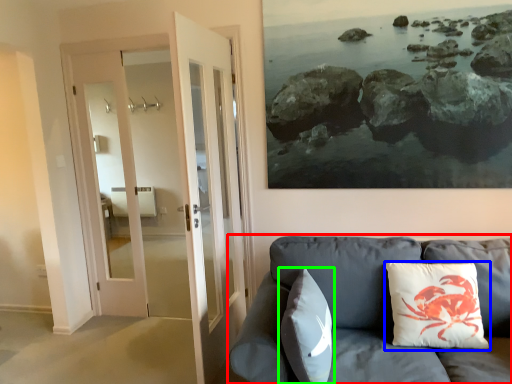
Question: Considering the real-world distances, which object is farthest from studio couch (highlighted by a red box)? pillow (highlighted by a blue box) or pillow (highlighted by a green box)?

Choices:
 (A) pillow
 (B) pillow

Answer: (B)